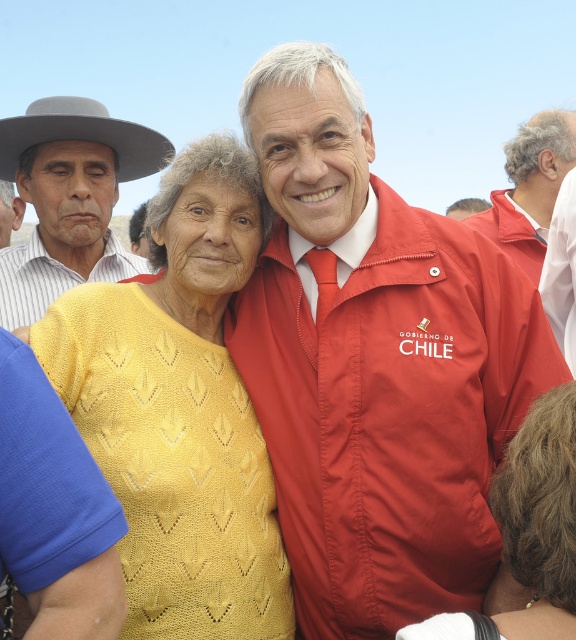
You are a photographer trying to capture a wide shot of the scene. The yellow knit sweater at center and the gray felt cowboy hat at upper left are both in your frame. Which object appears narrower in your photo?

The yellow knit sweater at center appears narrower in the photo because it has a lesser width compared to the gray felt cowboy hat at upper left.